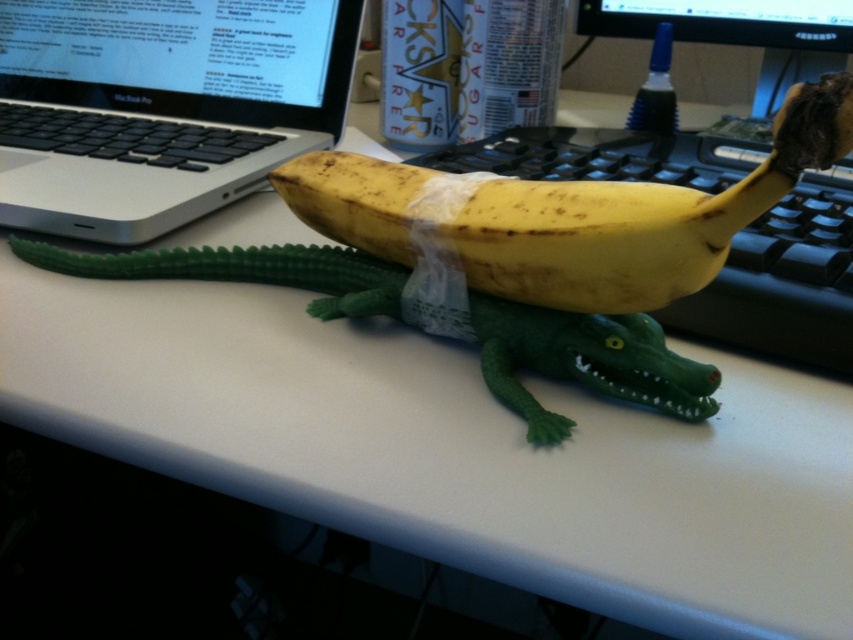
Question: Is silver metallic laptop at upper left smaller than glossy plastic monitor at upper center?

Choices:
 (A) yes
 (B) no

Answer: (B)

Question: Which object is the closest to the yellow matte banana at center?

Choices:
 (A) black glossy monitor at upper right
 (B) glossy plastic monitor at upper center
 (C) silver metallic laptop at upper left

Answer: (C)

Question: Is silver metallic laptop at upper left positioned behind yellow matte banana at center?

Choices:
 (A) no
 (B) yes

Answer: (B)

Question: Does yellow matte banana at center come in front of black glossy monitor at upper right?

Choices:
 (A) no
 (B) yes

Answer: (B)

Question: Which point appears farthest from the camera in this image?

Choices:
 (A) (13, 45)
 (B) (612, 8)
 (C) (784, 35)
 (D) (375, 248)

Answer: (A)

Question: Among these points, which one is nearest to the camera?

Choices:
 (A) (775, 24)
 (B) (824, 65)

Answer: (A)